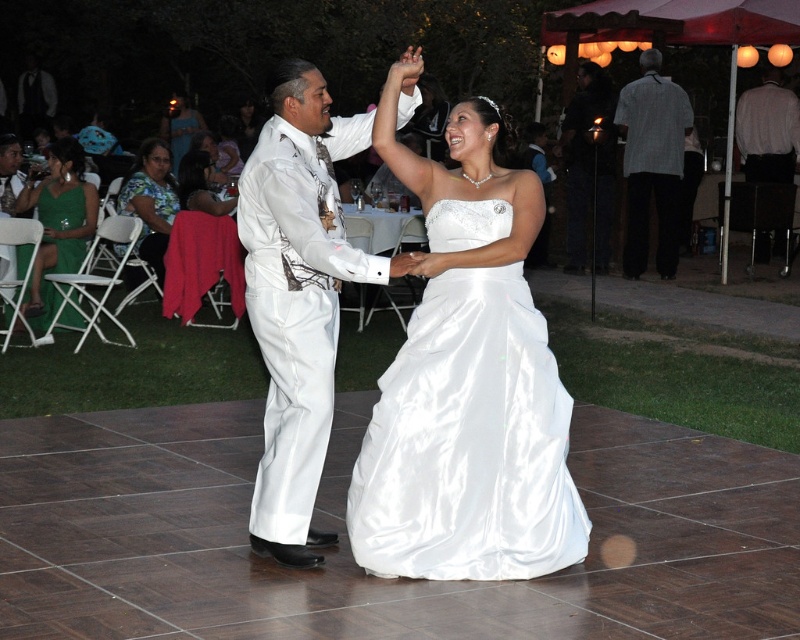
You are a photographer at the wedding. You need to capture a photo of the satin dress at center and the matte black suit at right. Based on their positions, which one is closer to the left side of the frame?

The satin dress at center is to the left of the matte black suit at right, so the satin dress at center is closer to the left side of the frame.

You are a photographer positioned at the camera location. You want to take a photo of the dancing couple and ensure they are in focus while the background guests remain slightly blurred. Given the distance between the camera and point (248, 280) is 18.42 feet, what is the minimum distance you should set the focus point to capture the couple clearly?

The minimum focus distance should be set to at least 18.42 feet to ensure the dancing couple at point (248, 280) are in focus while keeping the background guests blurred.

You are a photographer at the wedding, and you want to capture a photo of the satin dress at center and the matte black suit at right. Based on their sizes, which one should you zoom in more on to ensure both are equally visible in the frame?

The satin dress at center is wider than the matte black suit at right, so you should zoom in more on the matte black suit at right to balance their visibility in the photo.